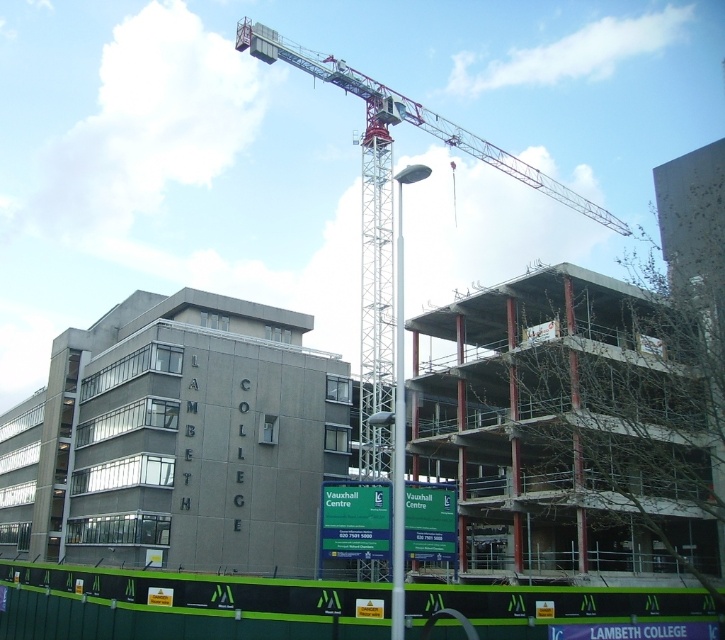
Is gray concrete building at left above metallic gray crane at upper center?

No.

Is point (344, 372) less distant than point (563, 196)?

Yes, point (344, 372) is closer to viewer.

Where is `gray concrete building at left`? gray concrete building at left is located at coordinates (178, 440).

Can you confirm if metallic gray crane at upper center is positioned below metallic pole at center?

No.

Can you confirm if metallic gray crane at upper center is positioned to the left of metallic pole at center?

Indeed, metallic gray crane at upper center is positioned on the left side of metallic pole at center.

Identify the location of metallic gray crane at upper center. This screenshot has height=640, width=725. (392, 211).

Can you confirm if gray concrete building at left is positioned to the left of metallic pole at center?

Yes, gray concrete building at left is to the left of metallic pole at center.

At what (x,y) coordinates should I click in order to perform the action: click on gray concrete building at left. Please return your answer as a coordinate pair (x, y). This screenshot has height=640, width=725. Looking at the image, I should click on 178,440.